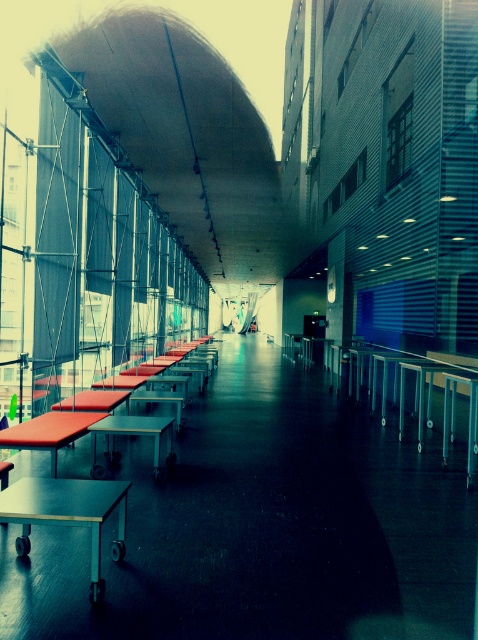
Who is more forward, (x=121, y=417) or (x=94, y=524)?

Point (x=94, y=524) is in front.

Does point (78, 496) come closer to viewer compared to point (82, 490)?

That is True.

This screenshot has height=640, width=478. Identify the location of wooden picnic table at center. (68, 513).

Describe the element at coordinates (67, 513) in the screenshot. I see `light brown wooden table at lower left` at that location.

Can you confirm if light brown wooden table at lower left is positioned below light brown wooden table at center?

Correct, light brown wooden table at lower left is located below light brown wooden table at center.

This screenshot has width=478, height=640. What are the coordinates of `light brown wooden table at lower left` in the screenshot? It's located at (67, 513).

Can you confirm if wooden picnic table at center is wider than matte metal table at left?

Correct, the width of wooden picnic table at center exceeds that of matte metal table at left.

Looking at this image, is wooden picnic table at center to the left of matte metal table at left from the viewer's perspective?

Incorrect, wooden picnic table at center is not on the left side of matte metal table at left.

Identify the location of wooden picnic table at center. This screenshot has height=640, width=478. click(x=68, y=513).